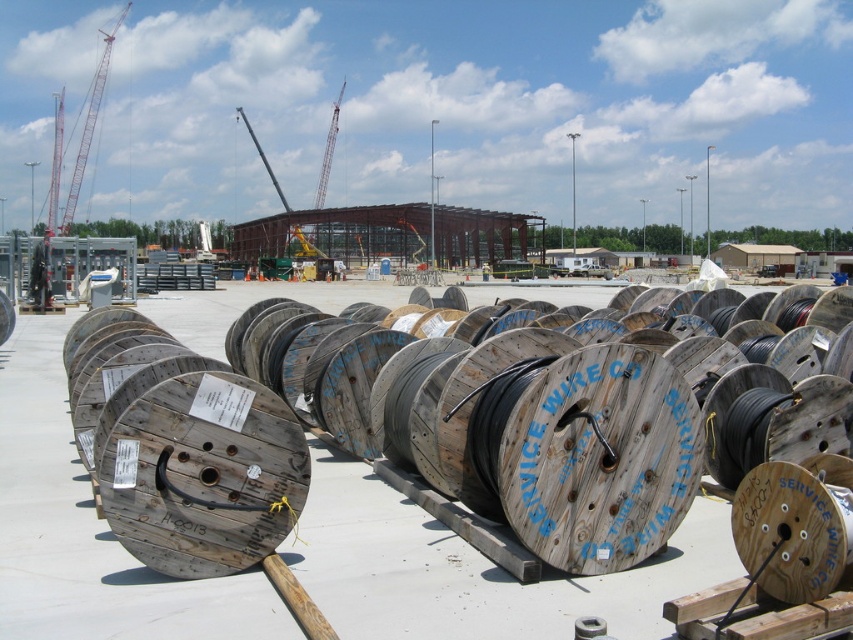
You are an engineer inspecting the construction site. You need to choose between the wooden spool at center and the wooden spools of wire at center for a project that requires a wider spool. Which one should you select?

The wooden spools of wire at center have a greater width than the wooden spool at center, so you should select the wooden spools of wire at center for the project that requires a wider spool.

You are a construction worker who needs to move the wooden spool at center. From your current position, which object would you have to move past first to reach the red metal crane at upper left?

The wooden spool at center is in front of the red metal crane at upper left, so you would have to move past the wooden spool at center first to reach the red metal crane at upper left.